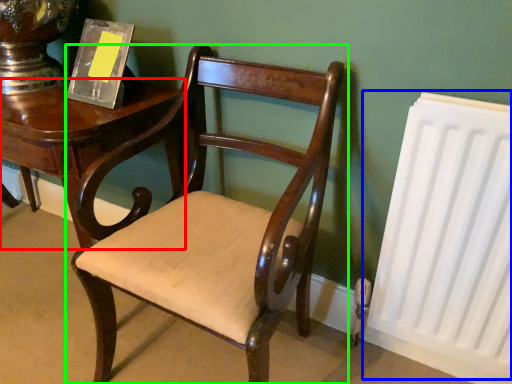
Question: Based on their relative distances, which object is farther from table (highlighted by a red box)? Choose from radiator (highlighted by a blue box) and chair (highlighted by a green box).

Choices:
 (A) radiator
 (B) chair

Answer: (A)